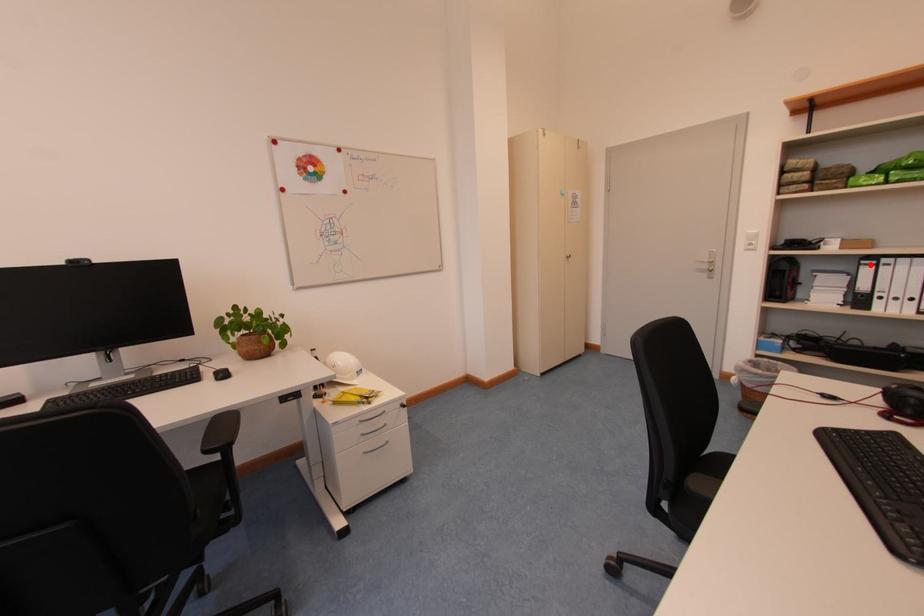
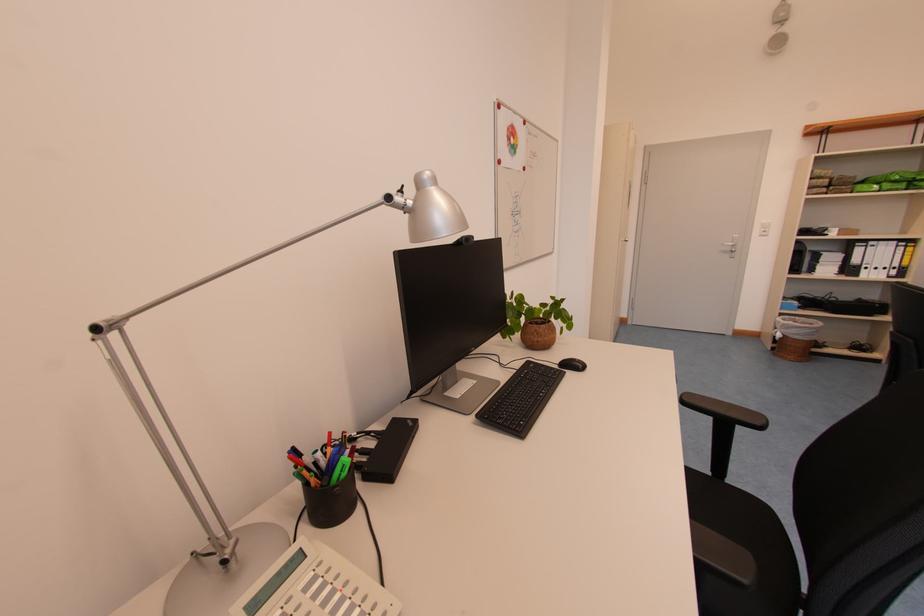
Question: I am providing you with two images of the same scene from different viewpoints. A red point is marked on the first image. Can you still see the location of the red point in image 2?

Choices:
 (A) Yes
 (B) No

Answer: (A)